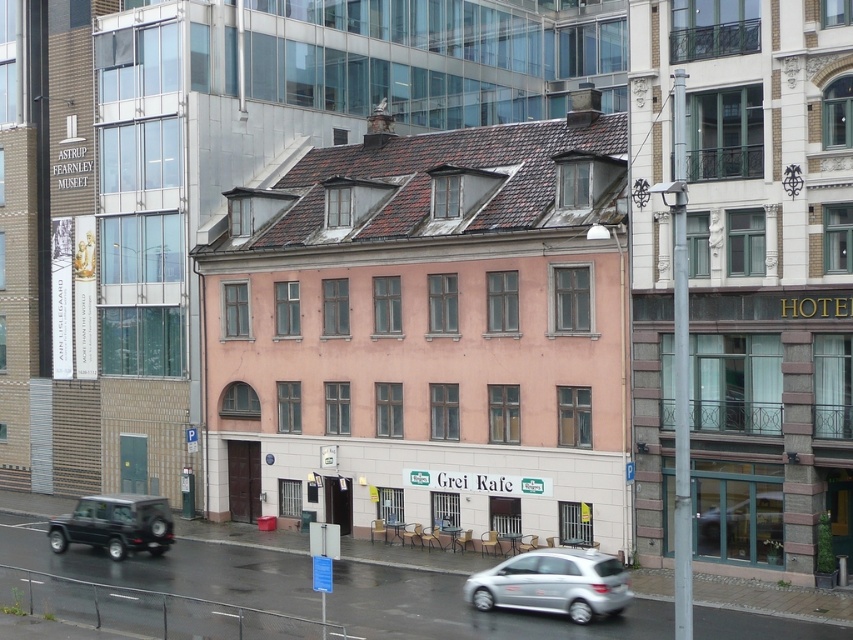
Can you confirm if silver metallic hatchback at lower center is taller than matte black suv at lower left?

Incorrect, silver metallic hatchback at lower center's height is not larger of matte black suv at lower left's.

Can you confirm if silver metallic hatchback at lower center is smaller than matte black suv at lower left?

Indeed, silver metallic hatchback at lower center has a smaller size compared to matte black suv at lower left.

Who is more distant from viewer, (537, 557) or (90, 534)?

The point (90, 534) is behind.

Locate an element on the screen. silver metallic hatchback at lower center is located at coordinates (553, 582).